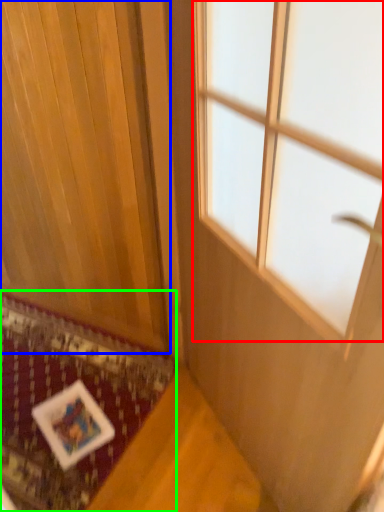
Question: Which object is the closest to the window (highlighted by a red box)? Choose among these: curtain (highlighted by a blue box) or mat (highlighted by a green box).

Choices:
 (A) curtain
 (B) mat

Answer: (A)